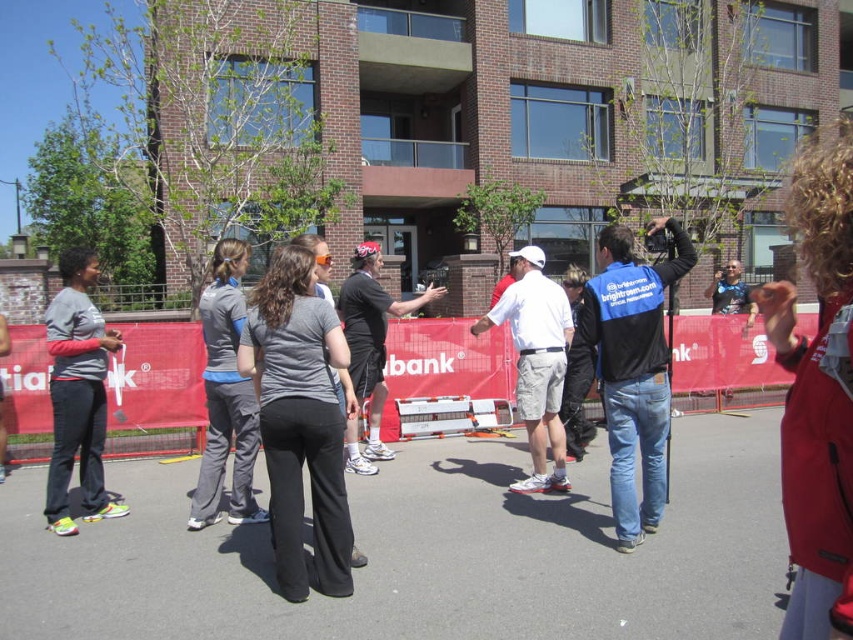
Is red fabric barrier at center above blue/black jacket at center?

No.

Is point (38, 388) farther from viewer compared to point (654, 346)?

Yes, it is.

The width and height of the screenshot is (853, 640). What do you see at coordinates (445, 364) in the screenshot?
I see `red fabric barrier at center` at bounding box center [445, 364].

The image size is (853, 640). Find the location of `red fabric barrier at center`. red fabric barrier at center is located at coordinates 445,364.

Who is positioned more to the left, red fabric barrier at center or black cotton t-shirt at center?

black cotton t-shirt at center

Between red fabric barrier at center and black cotton t-shirt at center, which one is positioned lower?

Positioned lower is red fabric barrier at center.

Which is in front, point (492, 344) or point (358, 298)?

Point (358, 298) is in front.

Locate an element on the screen. The image size is (853, 640). red fabric barrier at center is located at coordinates (445, 364).

Between point (102, 349) and point (248, 433), which one is positioned behind?

The point (102, 349) is more distant.

You are a GUI agent. You are given a task and a screenshot of the screen. Output one action in this format:
    pyautogui.click(x=<x>, y=<y>)
    Task: Click on the matte gray shirt at left
    
    Given the screenshot: What is the action you would take?
    pyautogui.click(x=77, y=394)

This screenshot has width=853, height=640. I want to click on matte gray shirt at left, so click(77, 394).